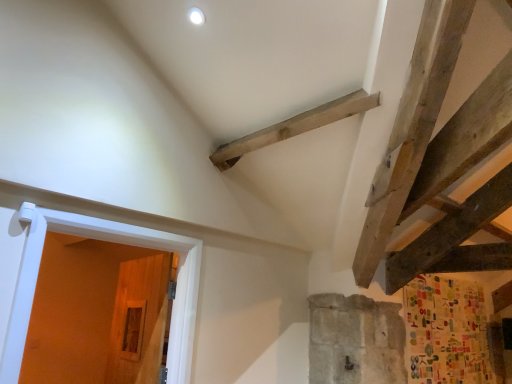
This screenshot has height=384, width=512. Find the location of `white painted wood door at left, the first door from the front`. white painted wood door at left, the first door from the front is located at coordinates (115, 242).

Image resolution: width=512 pixels, height=384 pixels. What do you see at coordinates (115, 242) in the screenshot?
I see `white painted wood door at left, which is the second door from back to front` at bounding box center [115, 242].

Where is `wooden door at lower left, which is counted as the first door, starting from the back`? Image resolution: width=512 pixels, height=384 pixels. wooden door at lower left, which is counted as the first door, starting from the back is located at coordinates (139, 320).

The height and width of the screenshot is (384, 512). What do you see at coordinates (139, 320) in the screenshot?
I see `wooden door at lower left, positioned as the 2th door in front-to-back order` at bounding box center [139, 320].

At what (x,y) coordinates should I click in order to perform the action: click on white painted wood door at left, the first door from the front. Please return your answer as a coordinate pair (x, y). Looking at the image, I should click on (115, 242).

Considering the positions of objects wooden door at lower left, positioned as the 2th door in front-to-back order, and white painted wood door at left, the first door from the front, in the image provided, who is more to the left, wooden door at lower left, positioned as the 2th door in front-to-back order, or white painted wood door at left, the first door from the front,?

wooden door at lower left, positioned as the 2th door in front-to-back order.

Is wooden door at lower left, positioned as the 2th door in front-to-back order, in front of white painted wood door at left, the first door from the front?

No, wooden door at lower left, positioned as the 2th door in front-to-back order, is behind white painted wood door at left, the first door from the front.

Considering the positions of points (121, 351) and (23, 300), is point (121, 351) closer to camera compared to point (23, 300)?

That is False.

From the image's perspective, is wooden door at lower left, which is counted as the first door, starting from the back, located above or below white painted wood door at left, the first door from the front?

wooden door at lower left, which is counted as the first door, starting from the back, is situated lower than white painted wood door at left, the first door from the front, in the image.

From a real-world perspective, between wooden door at lower left, positioned as the 2th door in front-to-back order, and white painted wood door at left, which is the second door from back to front, who is vertically lower?

wooden door at lower left, positioned as the 2th door in front-to-back order, from a real-world perspective.

Does wooden door at lower left, positioned as the 2th door in front-to-back order, have a greater width compared to white painted wood door at left, the first door from the front?

Correct, the width of wooden door at lower left, positioned as the 2th door in front-to-back order, exceeds that of white painted wood door at left, the first door from the front.

Is wooden door at lower left, which is counted as the first door, starting from the back, taller than white painted wood door at left, which is the second door from back to front?

Indeed, wooden door at lower left, which is counted as the first door, starting from the back, has a greater height compared to white painted wood door at left, which is the second door from back to front.

Is wooden door at lower left, positioned as the 2th door in front-to-back order, smaller than white painted wood door at left, the first door from the front?

Yes.

Is white painted wood door at left, which is the second door from back to front, a part of wooden door at lower left, positioned as the 2th door in front-to-back order?

Definitely not — white painted wood door at left, which is the second door from back to front, is not inside wooden door at lower left, positioned as the 2th door in front-to-back order.

Is wooden door at lower left, positioned as the 2th door in front-to-back order, facing away from white painted wood door at left, the first door from the front?

wooden door at lower left, positioned as the 2th door in front-to-back order, does not have its back to white painted wood door at left, the first door from the front.

Where is `door on the left of white painted wood door at left, the first door from the front`? door on the left of white painted wood door at left, the first door from the front is located at coordinates (139, 320).

Between white painted wood door at left, which is the second door from back to front, and wooden door at lower left, which is counted as the first door, starting from the back, which one appears on the right side from the viewer's perspective?

white painted wood door at left, which is the second door from back to front, is more to the right.

Which object is closer to the camera, white painted wood door at left, the first door from the front, or wooden door at lower left, which is counted as the first door, starting from the back?

white painted wood door at left, the first door from the front, is more forward.

Does point (180, 379) lie in front of point (132, 334)?

Yes, it is.

From the image's perspective, between white painted wood door at left, which is the second door from back to front, and wooden door at lower left, which is counted as the first door, starting from the back, which one is located above?

From the image's view, white painted wood door at left, which is the second door from back to front, is above.

From a real-world perspective, is white painted wood door at left, which is the second door from back to front, physically above wooden door at lower left, positioned as the 2th door in front-to-back order?

Indeed, from a real-world perspective, white painted wood door at left, which is the second door from back to front, stands above wooden door at lower left, positioned as the 2th door in front-to-back order.

Is white painted wood door at left, the first door from the front, wider than wooden door at lower left, positioned as the 2th door in front-to-back order?

No, white painted wood door at left, the first door from the front, is not wider than wooden door at lower left, positioned as the 2th door in front-to-back order.

Considering the relative sizes of white painted wood door at left, the first door from the front, and wooden door at lower left, positioned as the 2th door in front-to-back order, in the image provided, is white painted wood door at left, the first door from the front, taller than wooden door at lower left, positioned as the 2th door in front-to-back order,?

Incorrect, the height of white painted wood door at left, the first door from the front, is not larger of that of wooden door at lower left, positioned as the 2th door in front-to-back order.

Who is smaller, white painted wood door at left, the first door from the front, or wooden door at lower left, positioned as the 2th door in front-to-back order?

Smaller between the two is wooden door at lower left, positioned as the 2th door in front-to-back order.

Choose the correct answer: Is white painted wood door at left, which is the second door from back to front, inside wooden door at lower left, positioned as the 2th door in front-to-back order, or outside it?

white painted wood door at left, which is the second door from back to front, is outside wooden door at lower left, positioned as the 2th door in front-to-back order.

Is white painted wood door at left, the first door from the front, beside wooden door at lower left, which is counted as the first door, starting from the back?

They are not placed beside each other.

Is white painted wood door at left, the first door from the front, looking in the opposite direction of wooden door at lower left, which is counted as the first door, starting from the back?

Yes, white painted wood door at left, the first door from the front, is positioned with its back facing wooden door at lower left, which is counted as the first door, starting from the back.

This screenshot has height=384, width=512. I want to click on door on the left side of white painted wood door at left, the first door from the front, so click(139, 320).

Where is `door on the right of wooden door at lower left, which is counted as the first door, starting from the back`? The image size is (512, 384). door on the right of wooden door at lower left, which is counted as the first door, starting from the back is located at coordinates 115,242.

You are a GUI agent. You are given a task and a screenshot of the screen. Output one action in this format:
    pyautogui.click(x=<x>, y=<y>)
    Task: Click on the door that is on the left side of white painted wood door at left, which is the second door from back to front
    
    Given the screenshot: What is the action you would take?
    pyautogui.click(x=139, y=320)